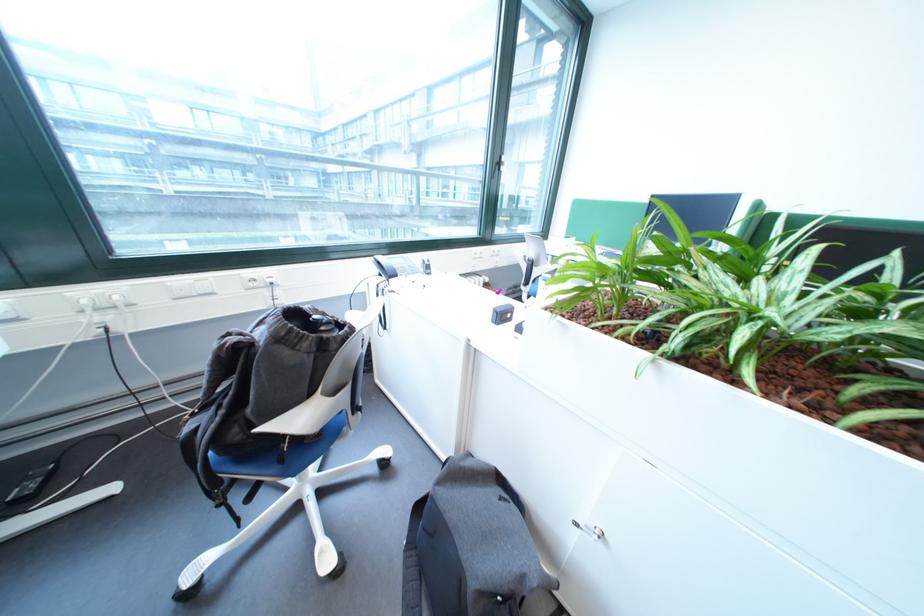
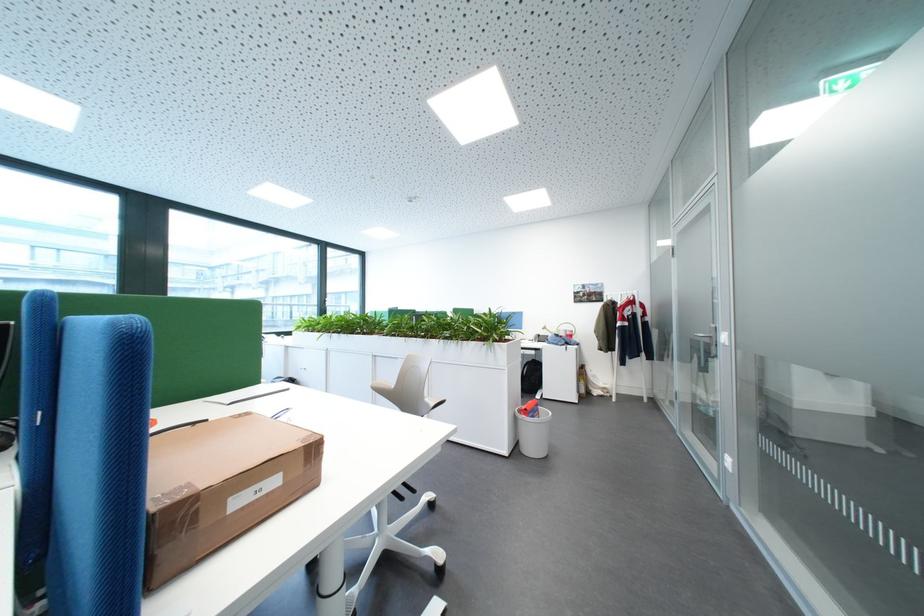
Question: I am providing you with two images of the same scene from different viewpoints. After the viewpoint changes to image2, which objects are now occluded?

Choices:
 (A) grey chair armrest
 (B) toy cash register
 (C) telephone handset
 (D) dark cabinet handle

Answer: (C)